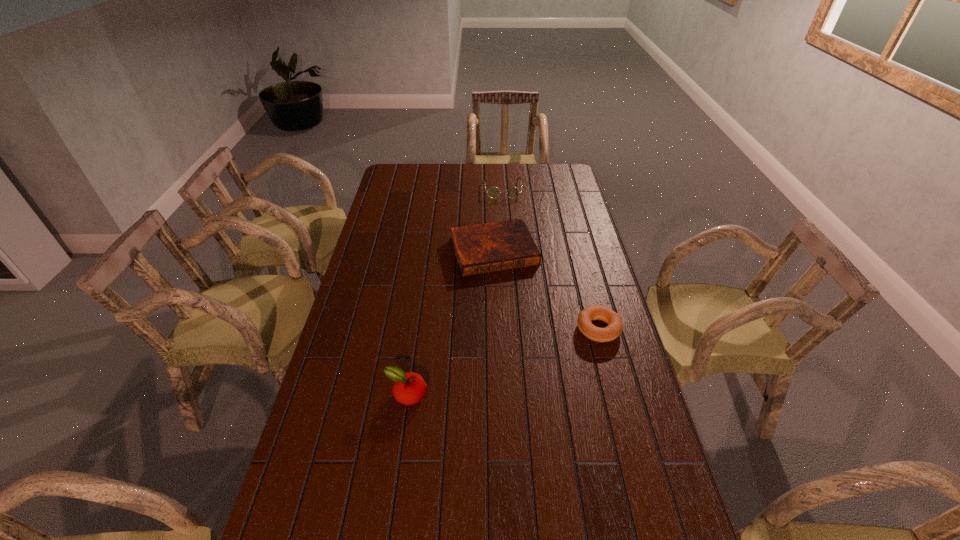
This screenshot has width=960, height=540. What are the coordinates of `blank space at the far left corner of the desktop` in the screenshot? It's located at (419, 164).

What are the coordinates of `free point at the far right corner` in the screenshot? It's located at (548, 172).

Where is `free area in between the spectacles and the Bible`? The height and width of the screenshot is (540, 960). free area in between the spectacles and the Bible is located at coordinates (498, 220).

I want to click on free space between the farthest object and the bagel, so click(x=551, y=259).

Locate an element on the screen. free area in between the apple and the spectacles is located at coordinates (455, 292).

You are a GUI agent. You are given a task and a screenshot of the screen. Output one action in this format:
    pyautogui.click(x=<x>, y=<y>)
    Task: Click on the vacant space that's between the third farthest object and the apple
    This screenshot has width=960, height=540.
    Given the screenshot: What is the action you would take?
    pyautogui.click(x=503, y=362)

This screenshot has height=540, width=960. In order to click on blank region between the farthest object and the rightmost object in this screenshot , I will do `click(551, 259)`.

Identify the location of empty space that is in between the third nearest object and the spectacles. This screenshot has width=960, height=540. (498, 220).

The width and height of the screenshot is (960, 540). I want to click on unoccupied area between the tallest object and the Bible, so (450, 323).

You are a GUI agent. You are given a task and a screenshot of the screen. Output one action in this format:
    pyautogui.click(x=<x>, y=<y>)
    Task: Click on the free point between the farthest object and the third nearest object
    The image size is (960, 540).
    Given the screenshot: What is the action you would take?
    pyautogui.click(x=498, y=220)